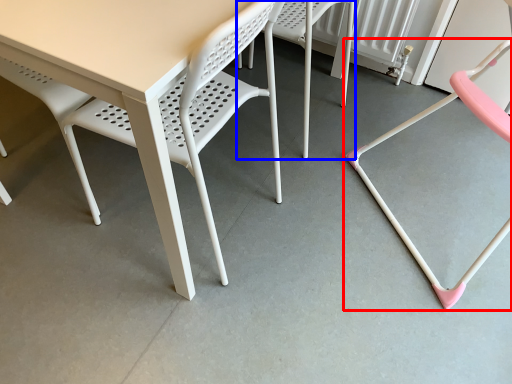
Question: Which object is further to the camera taking this photo, chair (highlighted by a red box) or chair (highlighted by a blue box)?

Choices:
 (A) chair
 (B) chair

Answer: (B)